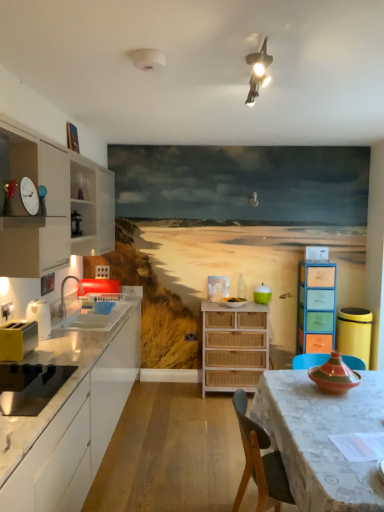
Question: From the image's perspective, is white glossy countertop at left, which ranks as the second cabinetry in top-to-bottom order, below black matte toaster at left, which ranks as the 1th appliance in front-to-back order?

Choices:
 (A) no
 (B) yes

Answer: (B)

Question: Would you say white glossy countertop at left, which ranks as the second cabinetry in top-to-bottom order, contains black matte toaster at left, the 6th appliance from the top?

Choices:
 (A) no
 (B) yes

Answer: (B)

Question: Would you say white glossy countertop at left, the 1th cabinetry positioned from the bottom, is a long distance from black matte toaster at left, which ranks as the 1th appliance in front-to-back order?

Choices:
 (A) no
 (B) yes

Answer: (A)

Question: Is white glossy countertop at left, the 1th cabinetry positioned from the bottom, facing away from black matte toaster at left, the 2th appliance when ordered from bottom to top?

Choices:
 (A) yes
 (B) no

Answer: (A)

Question: Is white glossy countertop at left, which ranks as the second cabinetry in top-to-bottom order, completely or partially outside of black matte toaster at left, the 6th appliance from the top?

Choices:
 (A) no
 (B) yes

Answer: (B)

Question: Is multicolored ceramic vase at table, which appears as the 6th appliance when viewed from the back, taller or shorter than white glossy sink at left?

Choices:
 (A) short
 (B) tall

Answer: (A)

Question: Is multicolored ceramic vase at table, which is the fifth appliance in top-to-bottom order, bigger or smaller than white glossy sink at left?

Choices:
 (A) small
 (B) big

Answer: (A)

Question: Is multicolored ceramic vase at table, the third appliance ordered from the bottom, wider or thinner than white glossy sink at left?

Choices:
 (A) wide
 (B) thin

Answer: (B)

Question: From the image's perspective, is multicolored ceramic vase at table, which is the second appliance in front-to-back order, positioned above or below white glossy sink at left?

Choices:
 (A) above
 (B) below

Answer: (B)

Question: Considering the positions of point (241, 358) and point (0, 374), is point (241, 358) closer or farther from the camera than point (0, 374)?

Choices:
 (A) farther
 (B) closer

Answer: (A)

Question: Is woven wood chest of drawers at center, placed as the first chest of drawers when sorted from left to right, taller or shorter than black matte toaster at left, the 5th appliance when ordered from right to left?

Choices:
 (A) short
 (B) tall

Answer: (B)

Question: Is woven wood chest of drawers at center, placed as the first chest of drawers when sorted from left to right, inside the boundaries of black matte toaster at left, the 2th appliance when ordered from bottom to top, or outside?

Choices:
 (A) outside
 (B) inside

Answer: (A)

Question: In terms of width, does woven wood chest of drawers at center, placed as the first chest of drawers when sorted from left to right, look wider or thinner when compared to black matte toaster at left, the 5th appliance when ordered from right to left?

Choices:
 (A) wide
 (B) thin

Answer: (A)

Question: Choose the correct answer: Is woven wood chest of drawers at center, acting as the second chest of drawers starting from the right, inside white glossy countertop at left, which ranks as the second cabinetry in top-to-bottom order, or outside it?

Choices:
 (A) outside
 (B) inside

Answer: (A)

Question: In terms of width, does woven wood chest of drawers at center, acting as the second chest of drawers starting from the right, look wider or thinner when compared to white glossy countertop at left, which ranks as the second cabinetry in top-to-bottom order?

Choices:
 (A) thin
 (B) wide

Answer: (A)